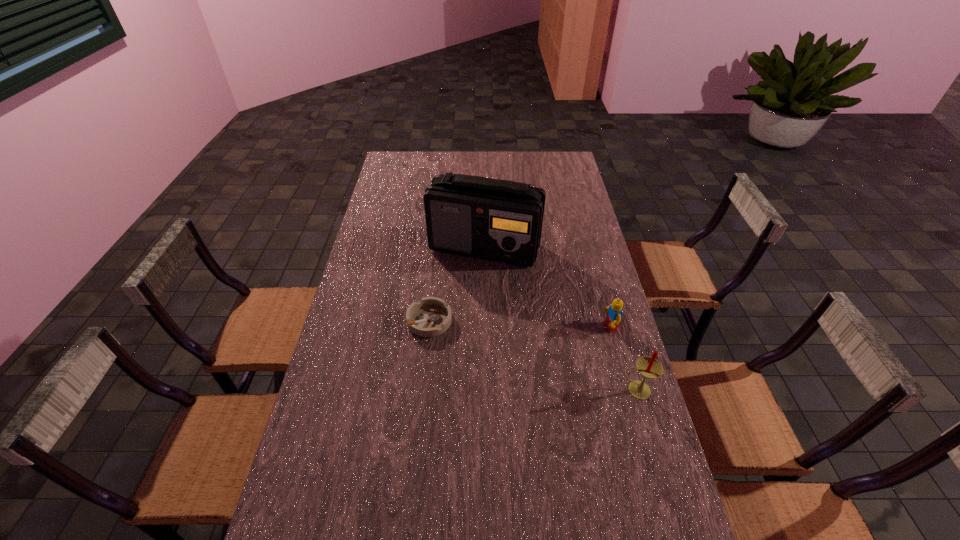
The height and width of the screenshot is (540, 960). Find the location of `ashtray`. ashtray is located at coordinates (431, 316).

Find the location of a particular element. The image size is (960, 540). the third shortest object is located at coordinates (650, 368).

Identify the location of the nearest object. Image resolution: width=960 pixels, height=540 pixels. (650, 368).

What are the coordinates of `the second shortest object` in the screenshot? It's located at (614, 313).

In order to click on the farthest object in this screenshot , I will do `click(499, 220)`.

This screenshot has width=960, height=540. I want to click on radio receiver, so click(499, 220).

Image resolution: width=960 pixels, height=540 pixels. Identify the location of vacant space located on the back of the ashtray. (435, 275).

The width and height of the screenshot is (960, 540). I want to click on vacant region located on the front of the candle, so click(x=656, y=455).

The width and height of the screenshot is (960, 540). Identify the location of free region located 0.120m on the front-facing side of the Lego. (565, 335).

Identify the location of free space located on the front-facing side of the Lego. This screenshot has height=540, width=960. coord(516,342).